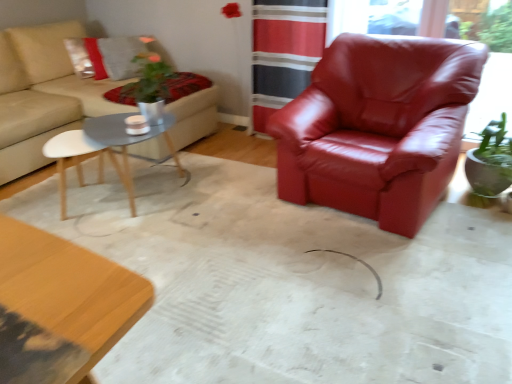
Find the location of a particular element. glossy leather armchair at right is located at coordinates (380, 16).

Measure the distance between velvet red blanket at upper left and camera.

The distance of velvet red blanket at upper left from camera is 9.48 feet.

What do you see at coordinates (106, 150) in the screenshot? I see `matte gray wood coffee table at center-left` at bounding box center [106, 150].

You are a GUI agent. You are given a task and a screenshot of the screen. Output one action in this format:
    pyautogui.click(x=<x>, y=<y>)
    Task: Click on the beige fabric couch at upper left
    
    Given the screenshot: What is the action you would take?
    pyautogui.click(x=42, y=94)

Image resolution: width=512 pixels, height=384 pixels. What are the coordinates of `satin red armchair at center` in the screenshot? It's located at (378, 127).

The image size is (512, 384). In order to click on glossy leather armchair at right in this screenshot , I will do `click(380, 16)`.

From the image's perspective, which one is positioned higher, satin red armchair at center or velvet red blanket at upper left?

From the image's view, velvet red blanket at upper left is above.

Does satin red armchair at center turn towards velvet red blanket at upper left?

No.

How different are the orientations of satin red armchair at center and velvet red blanket at upper left in degrees?

They differ by 95.7 degrees in their facing directions.

Is satin red armchair at center in front of velvet red blanket at upper left?

Yes, it is.

Is point (468, 127) positioned after point (360, 150)?

Yes, point (468, 127) is behind point (360, 150).

From the picture: Is glossy leather armchair at right aimed at satin red armchair at center?

Yes.

From a real-world perspective, who is located lower, glossy leather armchair at right or satin red armchair at center?

satin red armchair at center is physically lower.

Is glossy leather armchair at right beside satin red armchair at center?

No, glossy leather armchair at right is not next to satin red armchair at center.

Identify the location of chair above the matte gray wood coffee table at center-left (from a real-world perspective). The height and width of the screenshot is (384, 512). (378, 127).

Is satin red armchair at center facing towards matte gray wood coffee table at center-left?

Result: No, satin red armchair at center is not oriented towards matte gray wood coffee table at center-left.

Is satin red armchair at center wider than matte gray wood coffee table at center-left?

Indeed, satin red armchair at center has a greater width compared to matte gray wood coffee table at center-left.

From a real-world perspective, is satin red armchair at center positioned above or below matte gray wood coffee table at center-left?

satin red armchair at center is above matte gray wood coffee table at center-left.

Is beige fabric couch at upper left positioned far away from matte gray wood coffee table at center-left?

No, beige fabric couch at upper left is not far away from matte gray wood coffee table at center-left.

At what (x,y) coordinates should I click in order to perform the action: click on studio couch on the left of matte gray wood coffee table at center-left. Please return your answer as a coordinate pair (x, y). This screenshot has width=512, height=384. Looking at the image, I should click on (42, 94).

Does beige fabric couch at upper left have a lesser height compared to matte gray wood coffee table at center-left?

No.

Looking at this image, is beige fabric couch at upper left turned away from matte gray wood coffee table at center-left?

beige fabric couch at upper left is not turned away from matte gray wood coffee table at center-left.

Which object is positioned more to the left, beige fabric couch at upper left or red leather armchair at center?

beige fabric couch at upper left.

Is red leather armchair at center at the back of beige fabric couch at upper left?

No.

Which is farther from the camera, (3, 176) or (281, 1)?

The point (281, 1) is more distant.

From the image's perspective, which is above, velvet red blanket at upper left or red leather armchair at center?

red leather armchair at center, from the image's perspective.

Based on the photo, from a real-world perspective, is velvet red blanket at upper left on red leather armchair at center?

No, from a real-world perspective, velvet red blanket at upper left is not over red leather armchair at center

Would you say velvet red blanket at upper left is inside or outside red leather armchair at center?

velvet red blanket at upper left is not enclosed by red leather armchair at center.

Consider the image. Between matte gray wood coffee table at center-left and satin red armchair at center, which one has larger size?

With larger size is satin red armchair at center.

Considering the relative positions of matte gray wood coffee table at center-left and satin red armchair at center in the image provided, is matte gray wood coffee table at center-left to the left or to the right of satin red armchair at center?

matte gray wood coffee table at center-left is to the left of satin red armchair at center.

Does matte gray wood coffee table at center-left have a greater width compared to satin red armchair at center?

In fact, matte gray wood coffee table at center-left might be narrower than satin red armchair at center.

Could you tell me if matte gray wood coffee table at center-left is turned towards satin red armchair at center?

Yes.

Find the location of a particular element. The image size is (512, 384). blanket above the satin red armchair at center (from a real-world perspective) is located at coordinates (183, 85).

Image resolution: width=512 pixels, height=384 pixels. In the image, there is a glossy leather armchair at right. Identify the location of chair below it (from the image's perspective). (378, 127).

When comparing their distances from satin red armchair at center, does beige fabric couch at upper left or matte gray wood coffee table at center-left seem further?

beige fabric couch at upper left.

Based on their spatial positions, is velvet red blanket at upper left or glossy leather armchair at right further from red leather armchair at center?

glossy leather armchair at right.

Which object lies nearer to the anchor point red leather armchair at center, velvet red blanket at upper left or matte gray wood coffee table at center-left?

The object closer to red leather armchair at center is velvet red blanket at upper left.

When comparing their distances from beige fabric couch at upper left, does glossy leather armchair at right or red leather armchair at center seem closer?

Based on the image, red leather armchair at center appears to be nearer to beige fabric couch at upper left.

Based on their spatial positions, is glossy leather armchair at right or red leather armchair at center further from matte gray wood coffee table at center-left?

glossy leather armchair at right is positioned further to the anchor matte gray wood coffee table at center-left.

Which object lies nearer to the anchor point red leather armchair at center, satin red armchair at center or beige fabric couch at upper left?

satin red armchair at center lies closer to red leather armchair at center than the other object.

When comparing their distances from glossy leather armchair at right, does matte gray wood coffee table at center-left or velvet red blanket at upper left seem closer?

Among the two, velvet red blanket at upper left is located nearer to glossy leather armchair at right.

Based on their spatial positions, is red leather armchair at center or matte gray wood coffee table at center-left closer to satin red armchair at center?

red leather armchair at center lies closer to satin red armchair at center than the other object.

Locate an element on the screen. This screenshot has height=384, width=512. chair situated between beige fabric couch at upper left and glossy leather armchair at right from left to right is located at coordinates (378, 127).

You are a GUI agent. You are given a task and a screenshot of the screen. Output one action in this format:
    pyautogui.click(x=<x>, y=<y>)
    Task: Click on the chair between matte gray wood coffee table at center-left and glossy leather armchair at right from left to right
    The image size is (512, 384).
    Given the screenshot: What is the action you would take?
    pyautogui.click(x=378, y=127)

The width and height of the screenshot is (512, 384). Identify the location of curtain between velvet red blanket at upper left and glossy leather armchair at right in the horizontal direction. (283, 52).

Where is `blanket located between beige fabric couch at upper left and glossy leather armchair at right in the left-right direction`? Image resolution: width=512 pixels, height=384 pixels. blanket located between beige fabric couch at upper left and glossy leather armchair at right in the left-right direction is located at coordinates (183, 85).